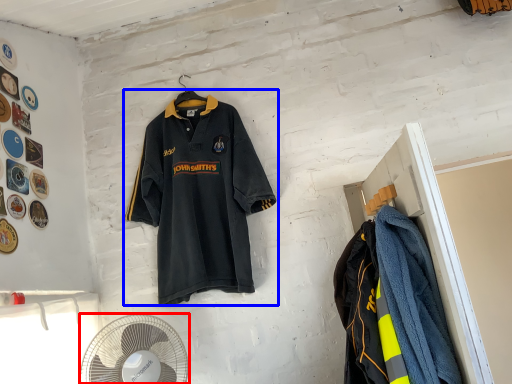
Question: Which object appears farthest to the camera in this image, mechanical fan (highlighted by a red box) or sports uniform (highlighted by a blue box)?

Choices:
 (A) mechanical fan
 (B) sports uniform

Answer: (B)